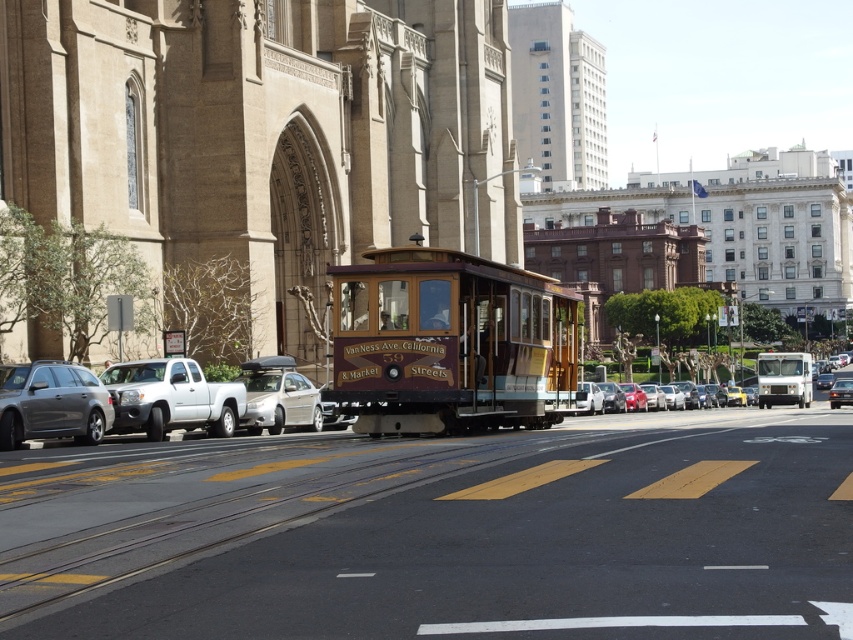
In the scene shown: You are standing on the sidewalk and want to cross the street to reach the yellow asphalt track at center. There is a matte gray station wagon at left blocking your path. Can you walk around the station wagon to access the track?

The yellow asphalt track at center is closer to the viewer than the matte gray station wagon at left, so you can walk around the station wagon to reach the track.

You are a delivery driver needing to park your vehicle. You see the yellow asphalt track at center and the matte gray station wagon at left. Which one is shorter in height?

The yellow asphalt track at center is not as tall as the matte gray station wagon at left, so the yellow asphalt track at center is shorter in height.

You are a pedestrian standing on the sidewalk and want to cross the street to reach the cable car. There are two vehicles blocking your path, the matte gray station wagon at left and the metallic silver sedan at center. Which vehicle do you need to go around first to get to the cable car?

The matte gray station wagon at left is positioned on the left side of the metallic silver sedan at center, so you should first go around the matte gray station wagon at left before reaching the metallic silver sedan at center to get to the cable car.